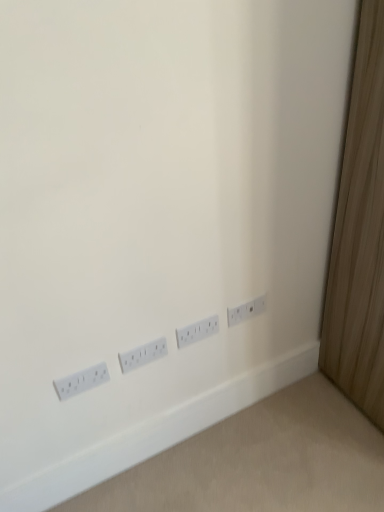
Question: Should I look upward or downward to see white plastic power plugs and sockets at lower right, which is counted as the 2th power plugs and sockets, starting from the right?

Choices:
 (A) down
 (B) up

Answer: (A)

Question: Is white plastic power plugs and sockets at lower right, the first power plugs and sockets when ordered from right to left, surrounded by white plastic power plugs and sockets at center, positioned as the second power plugs and sockets in left-to-right order?

Choices:
 (A) yes
 (B) no

Answer: (B)

Question: Considering the relative positions of white plastic power plugs and sockets at center, marked as the third power plugs and sockets in a right-to-left arrangement, and white plastic power plugs and sockets at lower right, the fourth power plugs and sockets viewed from the left, in the image provided, is white plastic power plugs and sockets at center, marked as the third power plugs and sockets in a right-to-left arrangement, in front of white plastic power plugs and sockets at lower right, the fourth power plugs and sockets viewed from the left,?

Choices:
 (A) yes
 (B) no

Answer: (A)

Question: From the image's perspective, is white plastic power plugs and sockets at center, marked as the third power plugs and sockets in a right-to-left arrangement, on top of white plastic power plugs and sockets at lower right, the fourth power plugs and sockets viewed from the left?

Choices:
 (A) no
 (B) yes

Answer: (A)

Question: Is white plastic power plugs and sockets at center, marked as the third power plugs and sockets in a right-to-left arrangement, oriented towards white plastic power plugs and sockets at lower right, the fourth power plugs and sockets viewed from the left?

Choices:
 (A) no
 (B) yes

Answer: (A)

Question: Can you confirm if white plastic power plugs and sockets at center, positioned as the second power plugs and sockets in left-to-right order, is shorter than white plastic power plugs and sockets at lower right, the first power plugs and sockets when ordered from right to left?

Choices:
 (A) yes
 (B) no

Answer: (B)

Question: Does white plastic power plugs and sockets at center, marked as the third power plugs and sockets in a right-to-left arrangement, have a lesser width compared to white plastic power plugs and sockets at lower right, the fourth power plugs and sockets viewed from the left?

Choices:
 (A) no
 (B) yes

Answer: (A)

Question: Is white plastic power plugs and sockets at lower right, the fourth power plugs and sockets viewed from the left, positioned behind white plastic power plugs and sockets at lower left, the 1th power plugs and sockets in the left-to-right sequence?

Choices:
 (A) yes
 (B) no

Answer: (A)

Question: From a real-world perspective, is white plastic power plugs and sockets at lower right, the fourth power plugs and sockets viewed from the left, physically below white plastic power plugs and sockets at lower left, the fourth power plugs and sockets viewed from the right?

Choices:
 (A) yes
 (B) no

Answer: (B)

Question: Is white plastic power plugs and sockets at lower right, the fourth power plugs and sockets viewed from the left, to the left of white plastic power plugs and sockets at lower left, the 1th power plugs and sockets in the left-to-right sequence, from the viewer's perspective?

Choices:
 (A) no
 (B) yes

Answer: (A)

Question: Can you confirm if white plastic power plugs and sockets at lower right, the fourth power plugs and sockets viewed from the left, is thinner than white plastic power plugs and sockets at lower left, the fourth power plugs and sockets viewed from the right?

Choices:
 (A) yes
 (B) no

Answer: (A)

Question: Is white plastic power plugs and sockets at lower right, the fourth power plugs and sockets viewed from the left, to the right of white plastic power plugs and sockets at lower left, the fourth power plugs and sockets viewed from the right, from the viewer's perspective?

Choices:
 (A) no
 (B) yes

Answer: (B)

Question: Considering the relative sizes of white plastic power plugs and sockets at lower right, the first power plugs and sockets when ordered from right to left, and white plastic power plugs and sockets at lower left, the 1th power plugs and sockets in the left-to-right sequence, in the image provided, is white plastic power plugs and sockets at lower right, the first power plugs and sockets when ordered from right to left, bigger than white plastic power plugs and sockets at lower left, the 1th power plugs and sockets in the left-to-right sequence,?

Choices:
 (A) yes
 (B) no

Answer: (B)

Question: Can you confirm if white plastic power plugs and sockets at center, positioned as the second power plugs and sockets in left-to-right order, is taller than white plastic power plugs and sockets at lower right, which is counted as the 2th power plugs and sockets, starting from the right?

Choices:
 (A) no
 (B) yes

Answer: (A)